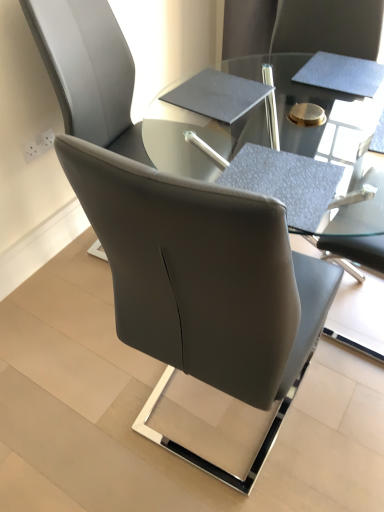
Question: From the image's perspective, does matte gray table at center appear lower than black matte notebook at center?

Choices:
 (A) yes
 (B) no

Answer: (B)

Question: Is black matte notebook at center inside matte gray table at center?

Choices:
 (A) yes
 (B) no

Answer: (B)

Question: Is matte gray table at center wider than black matte notebook at center?

Choices:
 (A) yes
 (B) no

Answer: (A)

Question: Does matte gray table at center have a lesser width compared to black matte notebook at center?

Choices:
 (A) yes
 (B) no

Answer: (B)

Question: From a real-world perspective, does matte gray table at center stand above black matte notebook at center?

Choices:
 (A) no
 (B) yes

Answer: (A)

Question: Do you think textured gray notepad at upper right is within black matte notebook at center, or outside of it?

Choices:
 (A) inside
 (B) outside

Answer: (B)

Question: From the image's perspective, is textured gray notepad at upper right positioned above or below black matte notebook at center?

Choices:
 (A) below
 (B) above

Answer: (B)

Question: In the image, is textured gray notepad at upper right on the left side or the right side of black matte notebook at center?

Choices:
 (A) left
 (B) right

Answer: (B)

Question: In the image, is textured gray notepad at upper right positioned in front of or behind black matte notebook at center?

Choices:
 (A) behind
 (B) front

Answer: (A)

Question: Considering the positions of black matte notebook at center and textured gray notepad at upper right in the image, is black matte notebook at center taller or shorter than textured gray notepad at upper right?

Choices:
 (A) tall
 (B) short

Answer: (A)

Question: From the image's perspective, relative to textured gray notepad at upper right, is black matte notebook at center above or below?

Choices:
 (A) below
 (B) above

Answer: (A)

Question: In the image, is black matte notebook at center positioned in front of or behind textured gray notepad at upper right?

Choices:
 (A) front
 (B) behind

Answer: (A)

Question: From a real-world perspective, is black matte notebook at center positioned above or below textured gray notepad at upper right?

Choices:
 (A) above
 (B) below

Answer: (B)

Question: In terms of height, does matte gray table at center look taller or shorter compared to satin black chair at center?

Choices:
 (A) short
 (B) tall

Answer: (B)

Question: Considering their positions, is matte gray table at center located in front of or behind satin black chair at center?

Choices:
 (A) front
 (B) behind

Answer: (B)